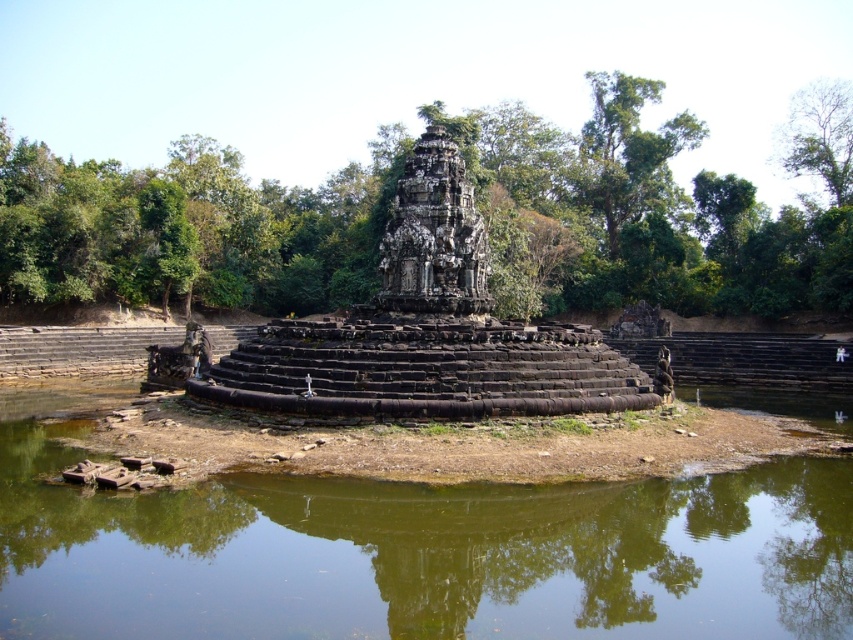
Question: Which object is positioned farthest from the green leafy tree at center?

Choices:
 (A) green leafy tree at upper right
 (B) dark gray stone temple at center
 (C) greenish-brown water at center

Answer: (C)

Question: Considering the real-world distances, which object is farthest from the greenish-brown water at center?

Choices:
 (A) green leafy tree at center
 (B) green leafy tree at upper right

Answer: (B)

Question: Which object appears farthest from the camera in this image?

Choices:
 (A) greenish-brown water at center
 (B) dark gray stone ruins at center

Answer: (B)

Question: Is green leafy tree at center wider than dark gray stone temple at center?

Choices:
 (A) no
 (B) yes

Answer: (B)

Question: Where is greenish-brown water at center located in relation to dark gray stone ruins at center in the image?

Choices:
 (A) left
 (B) right

Answer: (B)

Question: Is greenish-brown water at center closer to camera compared to dark gray stone temple at center?

Choices:
 (A) no
 (B) yes

Answer: (B)